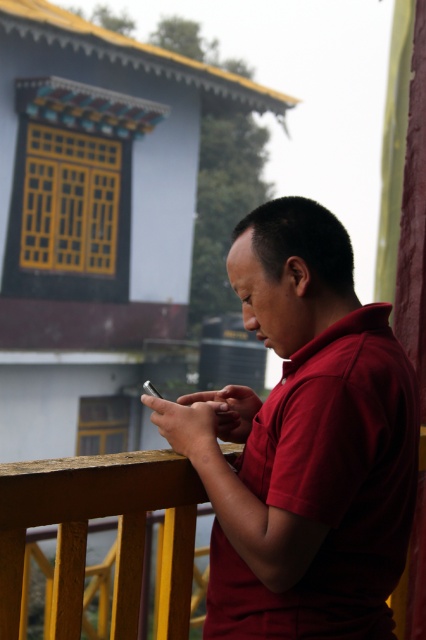
Question: Is matte red shirt at center wider than wooden railing at center?

Choices:
 (A) yes
 (B) no

Answer: (A)

Question: Is the position of matte red shirt at center less distant than that of wooden railing at center?

Choices:
 (A) yes
 (B) no

Answer: (B)

Question: Which point appears closest to the camera in this image?

Choices:
 (A) (6, 513)
 (B) (221, 403)

Answer: (A)

Question: Can you confirm if matte red shirt at center is wider than wooden railing at center?

Choices:
 (A) no
 (B) yes

Answer: (B)

Question: Which point is farther to the camera?

Choices:
 (A) matte red shirt at center
 (B) wooden railing at center

Answer: (A)